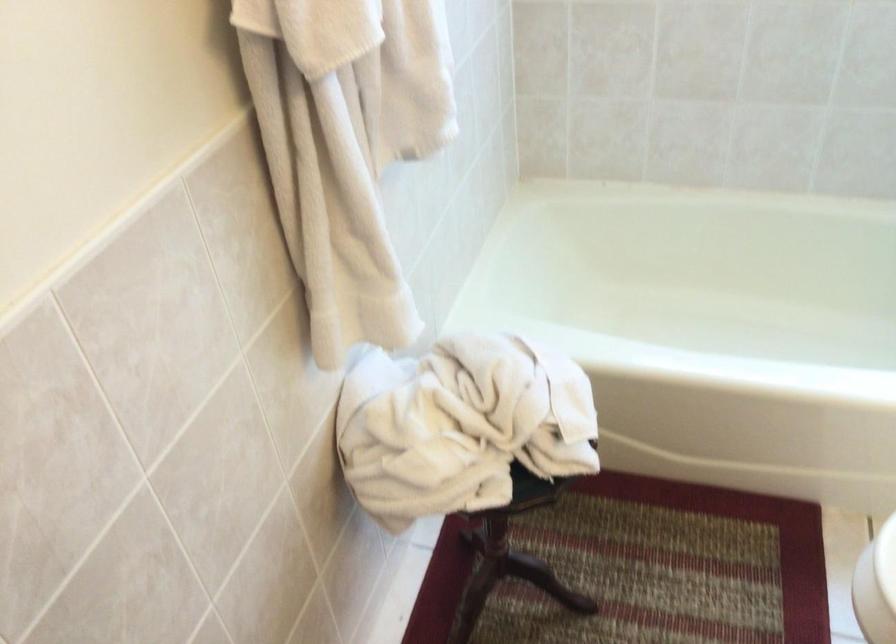
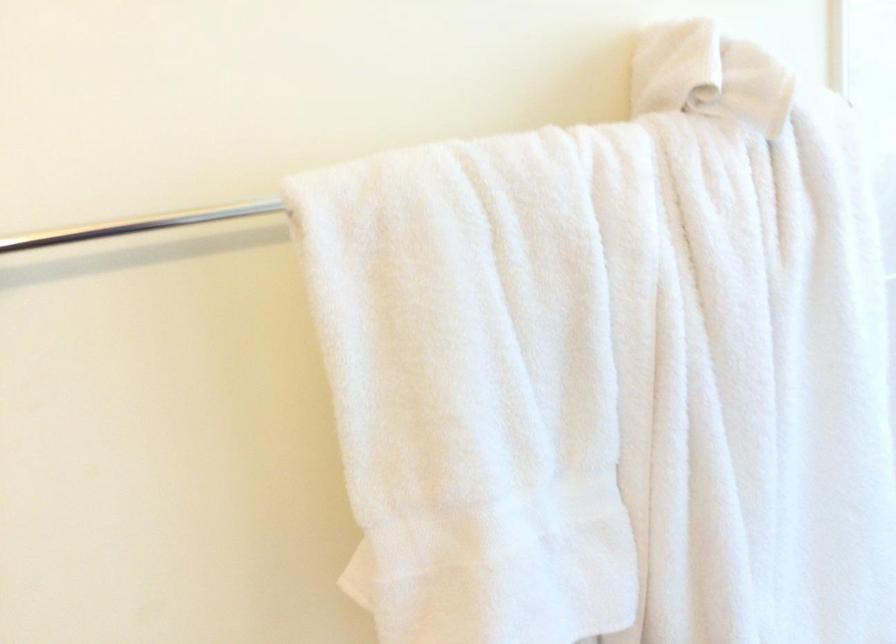
Question: Based on the continuous images, in which direction is the camera rotating? Reply with the corresponding letter.

Choices:
 (A) Left
 (B) Right
 (C) Up
 (D) Down

Answer: (A)